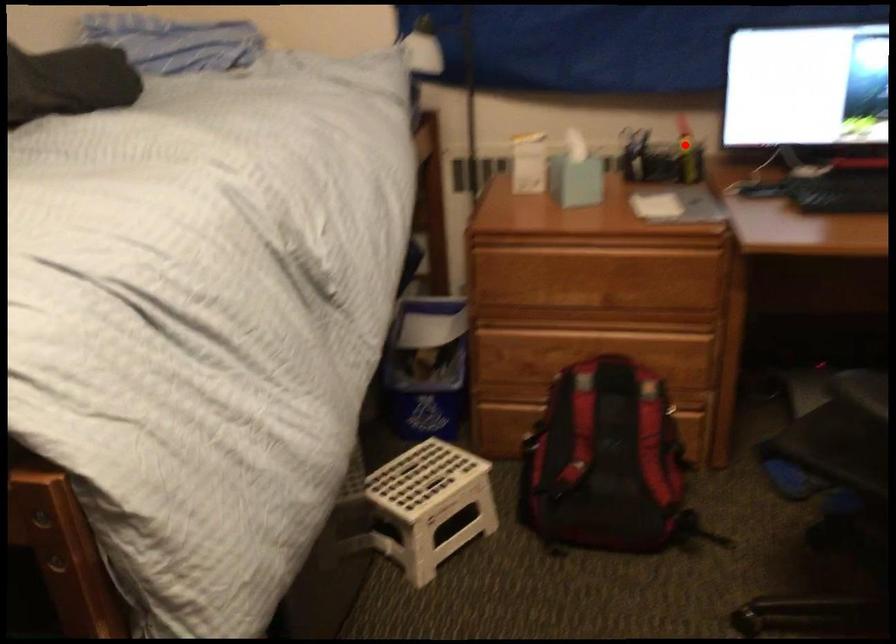
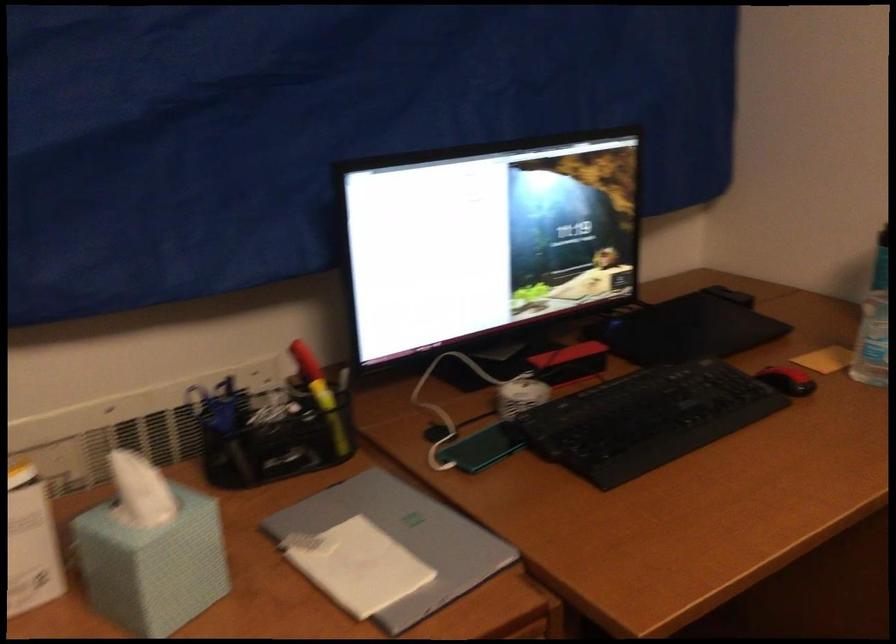
Question: I am providing you with two images of the same scene from different viewpoints. A red point is shown in image1. For the corresponding object point in image2, is it positioned nearer or farther from the camera?

Choices:
 (A) Nearer
 (B) Farther

Answer: (A)